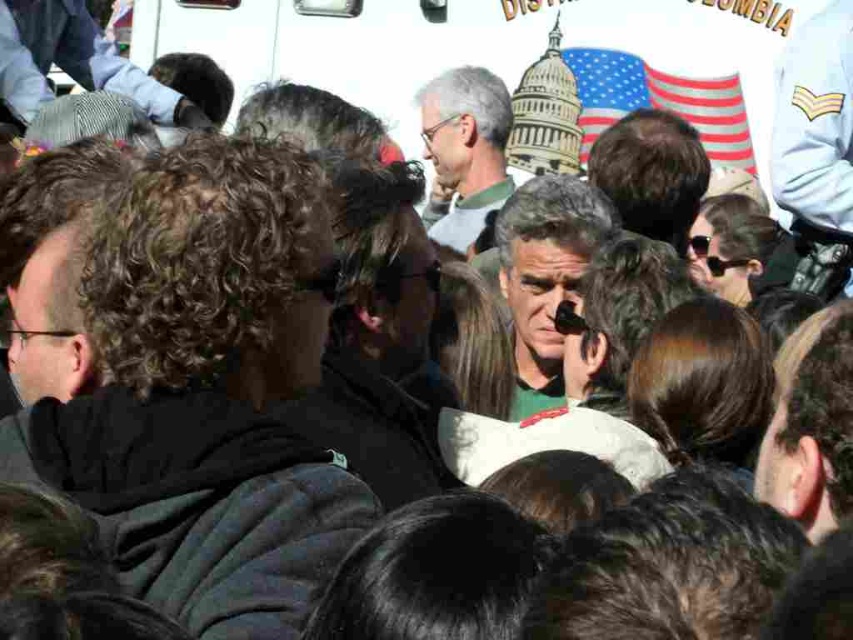
Which is more to the left, dark curly hair at center or gray hair man at center?

dark curly hair at center

Is dark curly hair at center taller than gray hair man at center?

Yes, dark curly hair at center is taller than gray hair man at center.

Who is more forward, (129,538) or (523,291)?

Point (129,538)

This screenshot has width=853, height=640. I want to click on dark curly hair at center, so click(196, 385).

The image size is (853, 640). What do you see at coordinates (196, 385) in the screenshot?
I see `dark curly hair at center` at bounding box center [196, 385].

Can you confirm if dark curly hair at center is positioned to the left of matte green shirt at center?

Yes, dark curly hair at center is to the left of matte green shirt at center.

At what (x,y) coordinates should I click in order to perform the action: click on dark curly hair at center. Please return your answer as a coordinate pair (x, y). Looking at the image, I should click on (196, 385).

Can you confirm if gray hair man at center is smaller than matte green shirt at center?

Incorrect, gray hair man at center is not smaller in size than matte green shirt at center.

Who is lower down, gray hair man at center or matte green shirt at center?

gray hair man at center

Between point (509, 288) and point (465, 241), which one is positioned behind?

The point (465, 241) is behind.

The image size is (853, 640). Identify the location of gray hair man at center. (543, 275).